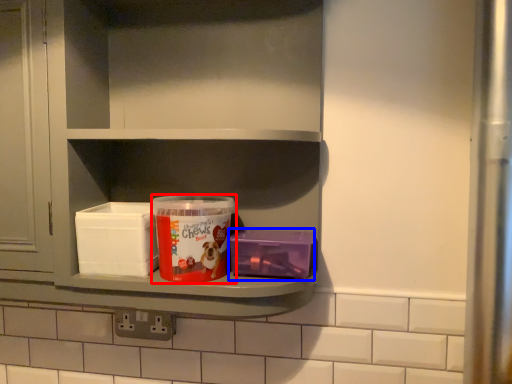
Question: Among these objects, which one is farthest to the camera, product (highlighted by a red box) or box (highlighted by a blue box)?

Choices:
 (A) product
 (B) box

Answer: (B)